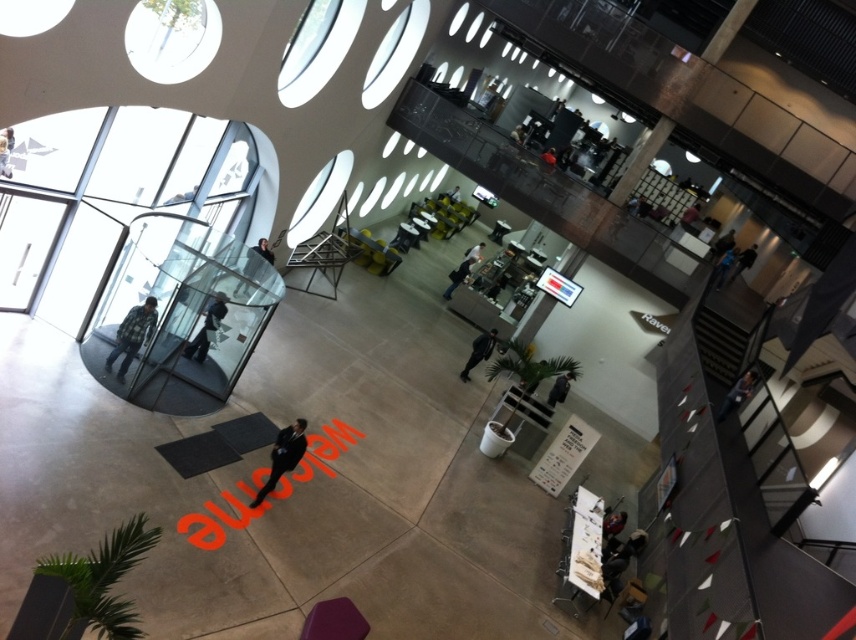
You are standing at the entrance of the building and see the dark suit at center and the dark blue jacket at upper right. Which one appears taller from your perspective?

The dark suit at center appears much taller than the dark blue jacket at upper right from your perspective.